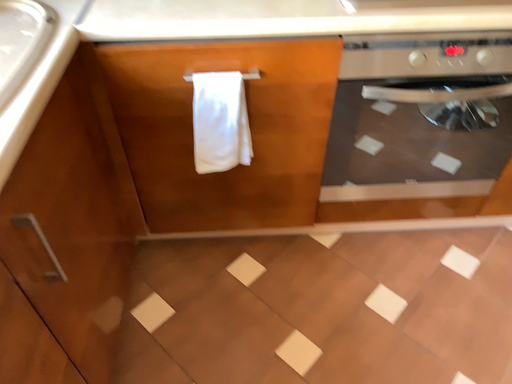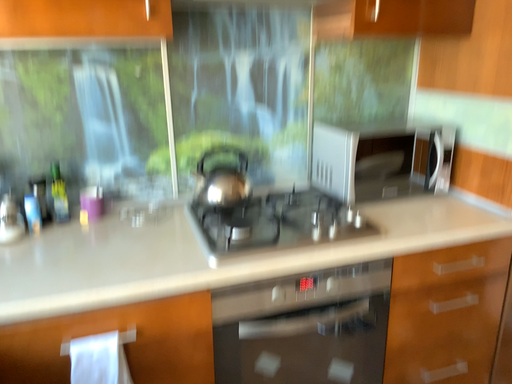
Question: Which way did the camera rotate in the video?

Choices:
 (A) rotated left
 (B) rotated right

Answer: (B)